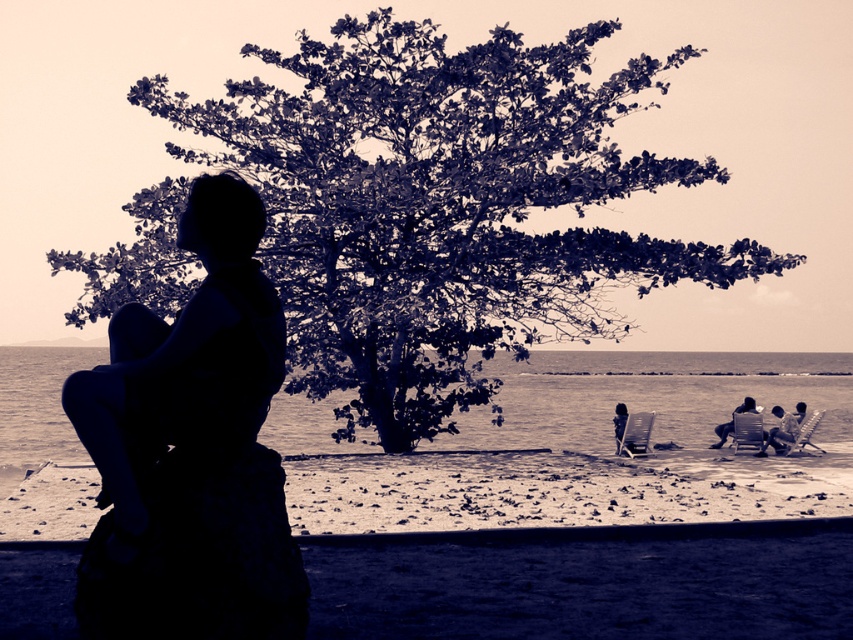
Question: Does green leafy tree at center appear on the left side of smooth beige chair at lower right?

Choices:
 (A) yes
 (B) no

Answer: (A)

Question: Which object is the closest to the green leafy tree at center?

Choices:
 (A) dark blue fabric chair at lower right
 (B) smooth beige chair at lower right
 (C) smooth fabric chair at lower right

Answer: (A)

Question: Which point is closer to the camera taking this photo?

Choices:
 (A) (718, 433)
 (B) (553, 365)
 (C) (851, 515)
 (D) (793, 432)

Answer: (C)

Question: Does smooth fabric chair at lower right lie in front of smooth beige chair at lower right?

Choices:
 (A) no
 (B) yes

Answer: (B)

Question: In this image, where is smooth sand at lower center located relative to smooth fabric chair at lower right?

Choices:
 (A) below
 (B) above

Answer: (A)

Question: Which point is farther to the camera?

Choices:
 (A) (622, 403)
 (B) (343, 468)
 (C) (743, 404)

Answer: (A)